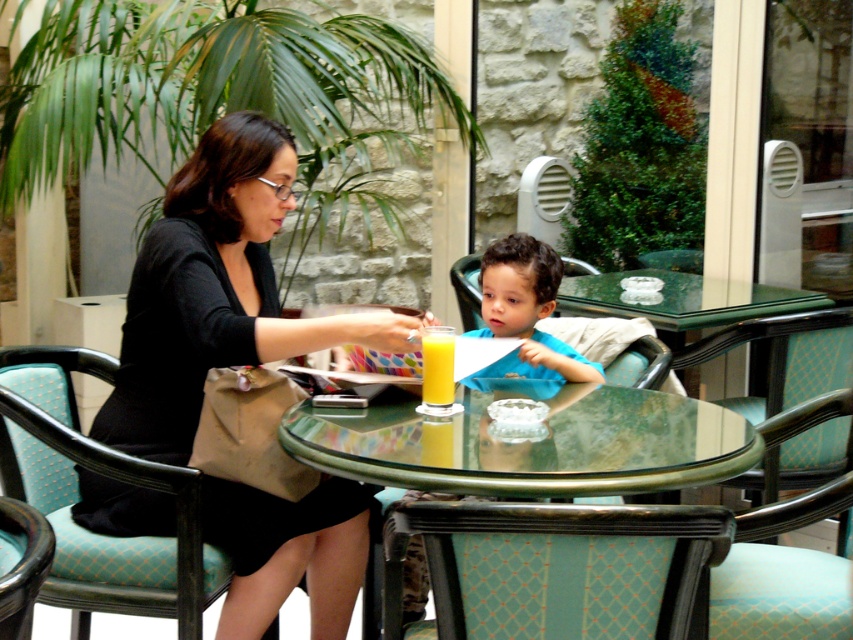
Question: In this image, where is transparent glass table at center located relative to blue matte shirt at center?

Choices:
 (A) right
 (B) left

Answer: (B)

Question: Which of the following is the closest to the observer?

Choices:
 (A) yellow glass at center
 (B) transparent glass table at center
 (C) textured teal fabric chair at lower center
 (D) teal fabric chair at left

Answer: (C)

Question: Is metallic green chair at lower left further to the viewer compared to yellow glass at center?

Choices:
 (A) yes
 (B) no

Answer: (B)

Question: Is teal fabric chair at left smaller than metallic green chair at lower left?

Choices:
 (A) no
 (B) yes

Answer: (A)

Question: Which is farther from the blue matte shirt at center?

Choices:
 (A) metallic green chair at lower left
 (B) matte black dress at center
 (C) transparent glass table at center
 (D) textured teal fabric chair at lower center

Answer: (A)

Question: Which point is farther from the camera taking this photo?

Choices:
 (A) (300, 321)
 (B) (523, 588)
 (C) (538, 291)
 (D) (16, 529)

Answer: (C)